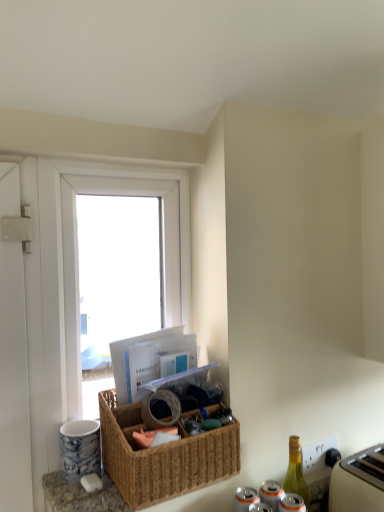
Question: Considering the relative positions of white plastic toaster at lower right and white plastic window at upper left in the image provided, is white plastic toaster at lower right to the right of white plastic window at upper left from the viewer's perspective?

Choices:
 (A) no
 (B) yes

Answer: (B)

Question: Is white plastic toaster at lower right closer to camera compared to white plastic window at upper left?

Choices:
 (A) no
 (B) yes

Answer: (B)

Question: Is white plastic window at upper left a part of white plastic toaster at lower right?

Choices:
 (A) no
 (B) yes

Answer: (A)

Question: Is there a large distance between white plastic toaster at lower right and white plastic window at upper left?

Choices:
 (A) yes
 (B) no

Answer: (B)

Question: From the image's perspective, is white plastic toaster at lower right above white plastic window at upper left?

Choices:
 (A) yes
 (B) no

Answer: (B)

Question: In the image, is woven brown picnic basket at center positioned in front of or behind green glass bottle at lower right?

Choices:
 (A) front
 (B) behind

Answer: (A)

Question: Looking at their shapes, would you say woven brown picnic basket at center is wider or thinner than green glass bottle at lower right?

Choices:
 (A) wide
 (B) thin

Answer: (A)

Question: Considering the positions of woven brown picnic basket at center and green glass bottle at lower right in the image, is woven brown picnic basket at center taller or shorter than green glass bottle at lower right?

Choices:
 (A) tall
 (B) short

Answer: (B)

Question: From the image's perspective, is woven brown picnic basket at center located above or below green glass bottle at lower right?

Choices:
 (A) below
 (B) above

Answer: (B)

Question: In terms of width, does woven brown picnic basket at center look wider or thinner when compared to white plastic toaster at lower right?

Choices:
 (A) wide
 (B) thin

Answer: (A)

Question: In the image, is woven brown picnic basket at center positioned in front of or behind white plastic toaster at lower right?

Choices:
 (A) front
 (B) behind

Answer: (A)

Question: From a real-world perspective, is woven brown picnic basket at center above or below white plastic toaster at lower right?

Choices:
 (A) above
 (B) below

Answer: (A)

Question: From their relative heights in the image, would you say woven brown picnic basket at center is taller or shorter than white plastic toaster at lower right?

Choices:
 (A) tall
 (B) short

Answer: (A)

Question: Is point (291, 458) positioned closer to the camera than point (233, 471)?

Choices:
 (A) closer
 (B) farther

Answer: (B)

Question: Is green glass bottle at lower right in front of or behind woven brown picnic basket at center in the image?

Choices:
 (A) behind
 (B) front

Answer: (A)